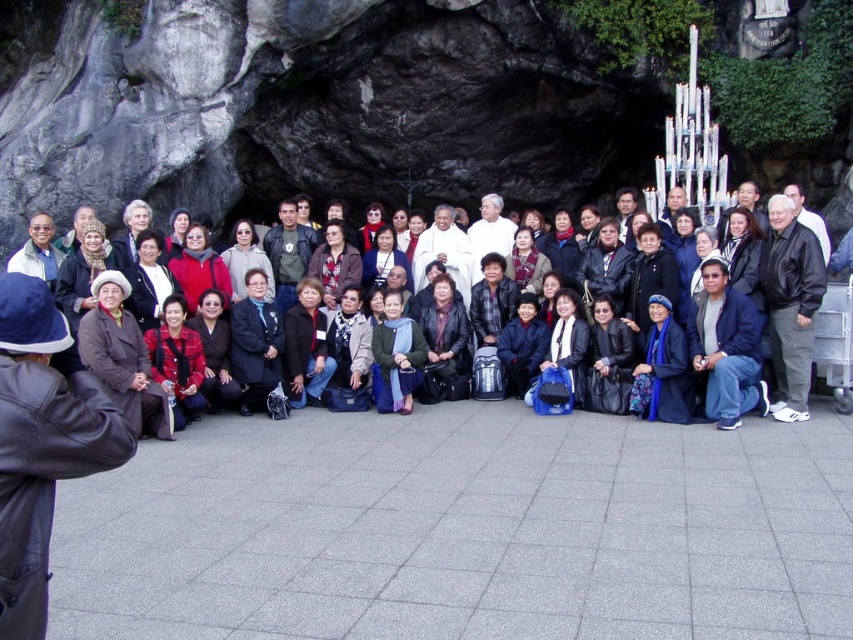
You are standing at the camera position and want to reach the point at coordinates (x=770, y=316). If you walk straight towards it, how far will you have to walk?

The point at coordinates (x=770, y=316) is 34.32 meters away from the camera. So you will have to walk 34.32 meters straight towards it.

You are standing in front of the large rock formation and want to take a photo of the group. You notice two points marked on the rock wall at coordinates point [807,284] and point [717,305]. Which of these points is closer to you?

Point [807,284] is closer to the viewer than point [717,305].

You are a photographer trying to capture the group photo of the people in front of the large rock formation. You notice that the matte black jacket at center is exactly at point (743, 330). If you want to ensure that the matte black jacket at center is centered in your photo, should you adjust your camera position to the left or right?

The matte black jacket at center is already at point (743, 330), which is the center of the image, so no adjustment is needed.